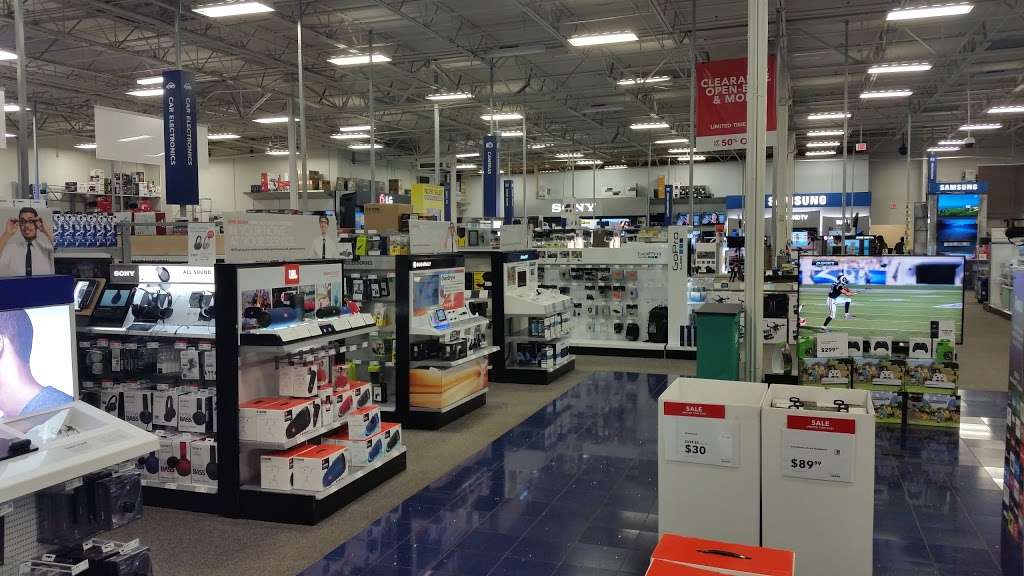
The width and height of the screenshot is (1024, 576). I want to click on white wall, so click(x=46, y=166), click(x=519, y=183), click(x=886, y=174).